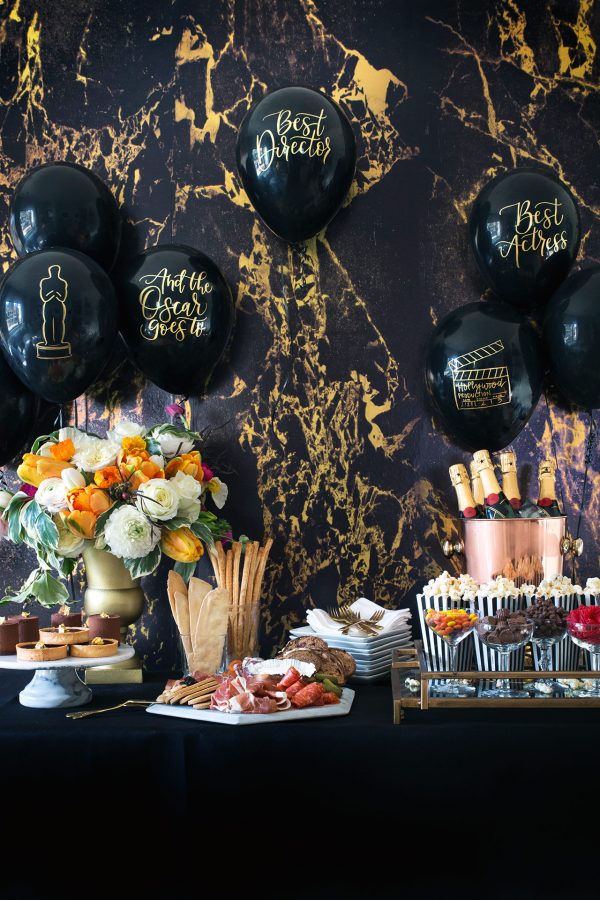
Find the location of a particular element. The width and height of the screenshot is (600, 900). wall is located at coordinates (400, 261).